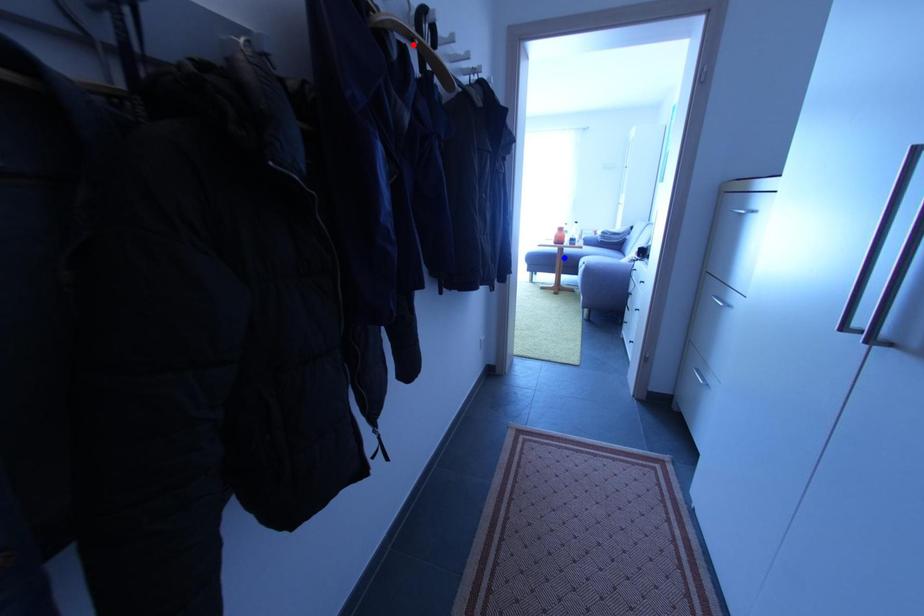
Question: Two points are marked on the image. Which point is closer to the camera?

Choices:
 (A) Blue point is closer.
 (B) Red point is closer.

Answer: (B)